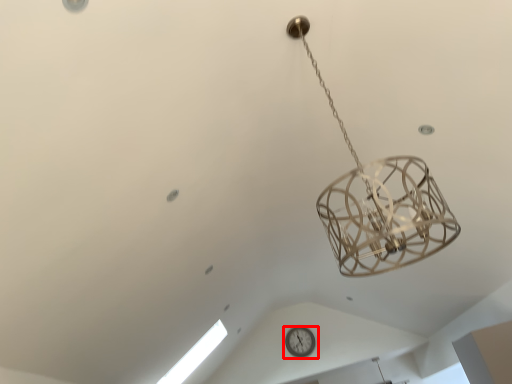
Question: Where is wall clock (annotated by the red box) located in relation to window in the image?

Choices:
 (A) right
 (B) left

Answer: (A)